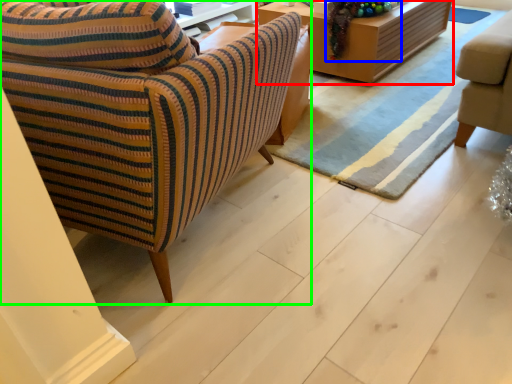
Question: Which object is positioned closest to table (highlighted by a red box)? Select from christmas decoration (highlighted by a blue box) and chair (highlighted by a green box).

Choices:
 (A) christmas decoration
 (B) chair

Answer: (A)